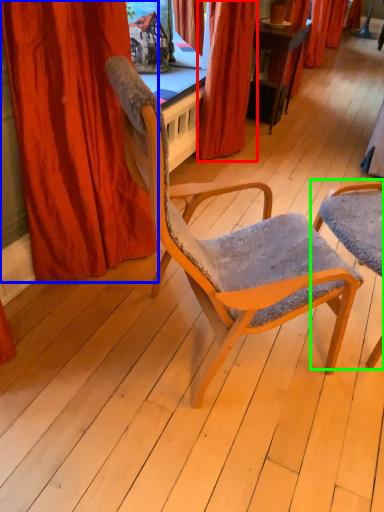
Question: Based on their relative distances, which object is farther from curtain (highlighted by a red box)? Choose from curtain (highlighted by a blue box) and chair (highlighted by a green box).

Choices:
 (A) curtain
 (B) chair

Answer: (A)